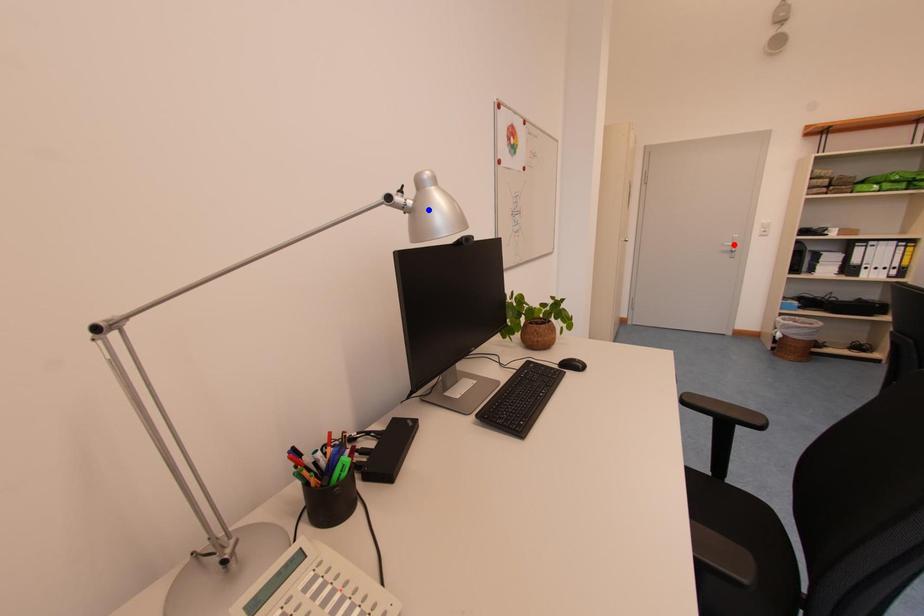
Question: Two points are marked on the image. Which point is closer to the camera?

Choices:
 (A) Blue point is closer.
 (B) Red point is closer.

Answer: (A)